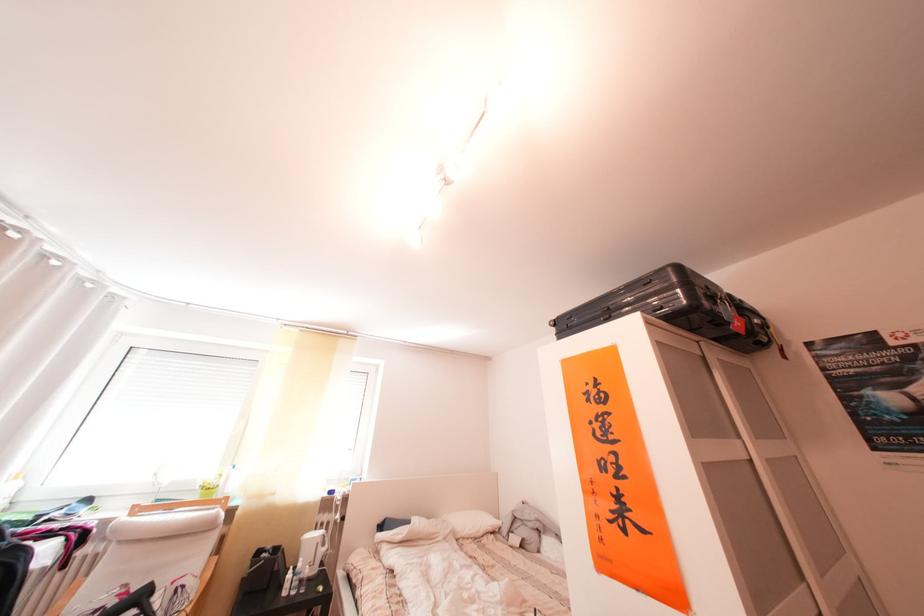
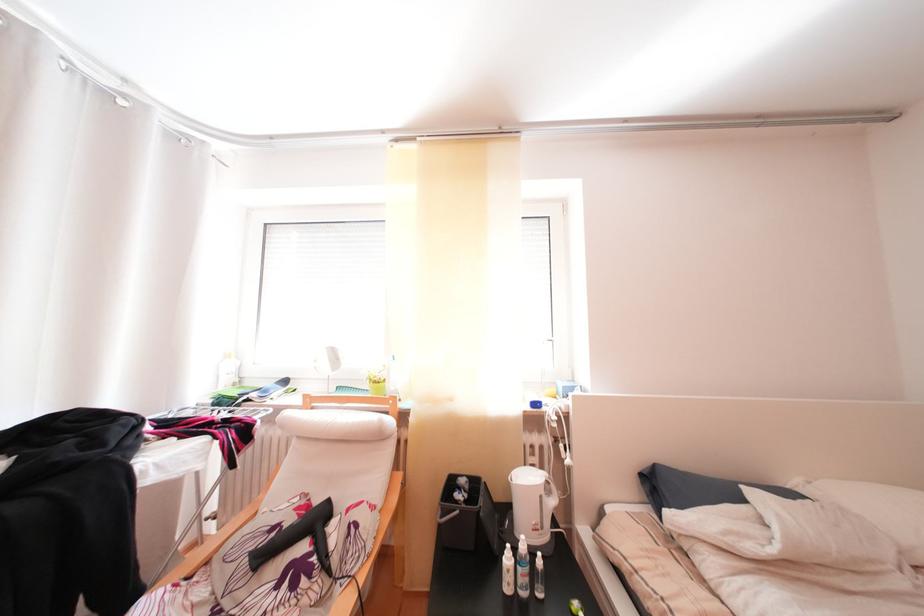
Find the pixel in the second image that matches (282,552) in the first image.

(475, 487)